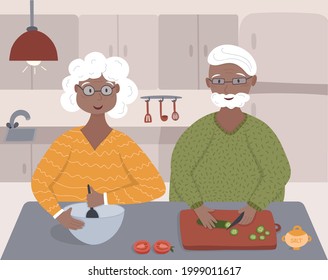
I want to click on utensils, so click(x=148, y=115), click(x=165, y=115), click(x=174, y=115), click(x=234, y=222), click(x=92, y=210).